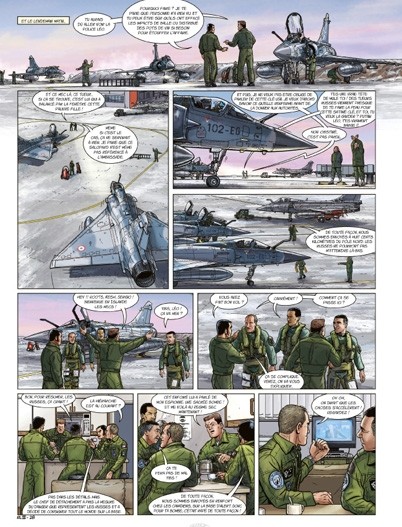
Where is `cabinets`? This screenshot has height=527, width=402. cabinets is located at coordinates (47, 70), (322, 48), (225, 126), (120, 230), (24, 416), (43, 411), (98, 419), (77, 403), (59, 408), (238, 403).